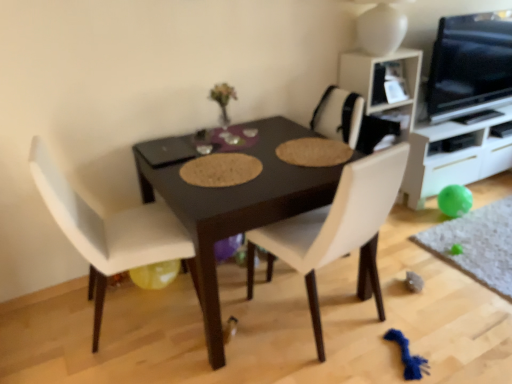
Question: Choose the correct answer: Is white leather chair at center, the first chair positioned from the right, inside yellow rubber balloon at lower left or outside it?

Choices:
 (A) inside
 (B) outside

Answer: (B)

Question: Looking at their shapes, would you say white leather chair at center, the second chair from the left, is wider or thinner than yellow rubber balloon at lower left?

Choices:
 (A) wide
 (B) thin

Answer: (A)

Question: Estimate the real-world distances between objects in this image. Which object is closer to the white leather chair at center, the second chair from the left?

Choices:
 (A) dark wood table at center
 (B) white glossy cabinet at right
 (C) green rubber ball at lower right
 (D) yellow rubber balloon at lower left
 (E) white leather chair at left, the 1th chair in the left-to-right sequence

Answer: (A)

Question: Considering the real-world distances, which object is closest to the white leather chair at center, the first chair positioned from the right?

Choices:
 (A) yellow rubber balloon at lower left
 (B) white glossy cabinet at right
 (C) dark wood table at center
 (D) green rubber ball at lower right
 (E) white leather chair at left, acting as the 2th chair starting from the right

Answer: (C)